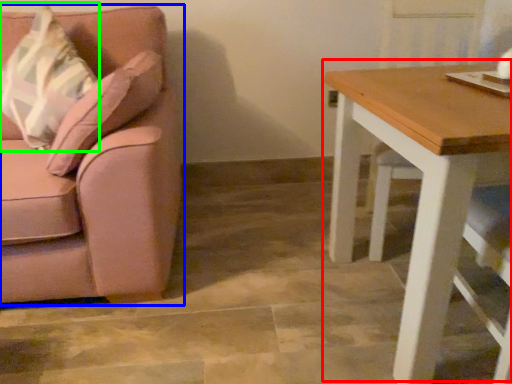
Question: Based on their relative distances, which object is farther from table (highlighted by a red box)? Choose from chair (highlighted by a blue box) and throw pillow (highlighted by a green box).

Choices:
 (A) chair
 (B) throw pillow

Answer: (B)